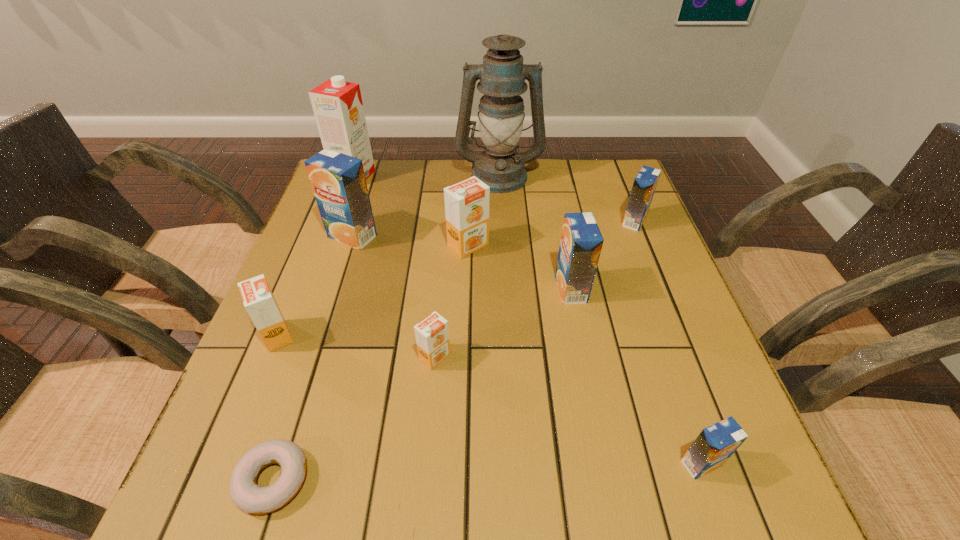
Where is `the smallest blue orange_juice`? This screenshot has width=960, height=540. the smallest blue orange_juice is located at coordinates (716, 443).

At what (x,y) coordinates should I click in order to perform the action: click on the nearest blue orange_juice. Please return your answer as a coordinate pair (x, y). The height and width of the screenshot is (540, 960). Looking at the image, I should click on (716, 443).

This screenshot has width=960, height=540. In order to click on the shortest object in this screenshot , I will do [249, 497].

Identify the location of brown doughnut. The width and height of the screenshot is (960, 540). (249, 497).

This screenshot has width=960, height=540. In order to click on vacant point located 0.050m on the left of the tallest object in this screenshot , I will do `click(440, 176)`.

The height and width of the screenshot is (540, 960). I want to click on free spot located 0.340m on the front of the carton, so coord(320,268).

Identify the location of free space located on the front of the tallest orange_juice. (302, 393).

At what (x,y) coordinates should I click in order to perform the action: click on vacant space located 0.360m on the back of the fourth nearest orange_juice. Please return your answer as a coordinate pair (x, y). Looking at the image, I should click on (550, 187).

The height and width of the screenshot is (540, 960). I want to click on vacant space situated on the back of the biggest orange orange juice, so click(470, 174).

Image resolution: width=960 pixels, height=540 pixels. In order to click on free location located on the left of the third biggest blue orange_juice in this screenshot , I will do `click(540, 221)`.